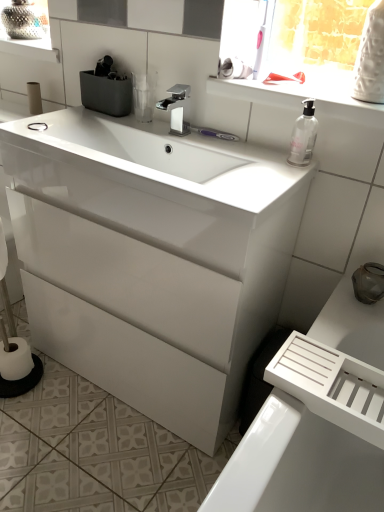
This screenshot has width=384, height=512. I want to click on vacant space in front of white matte toilet paper at lower left, the 2th toilet paper positioned from the front, so click(18, 411).